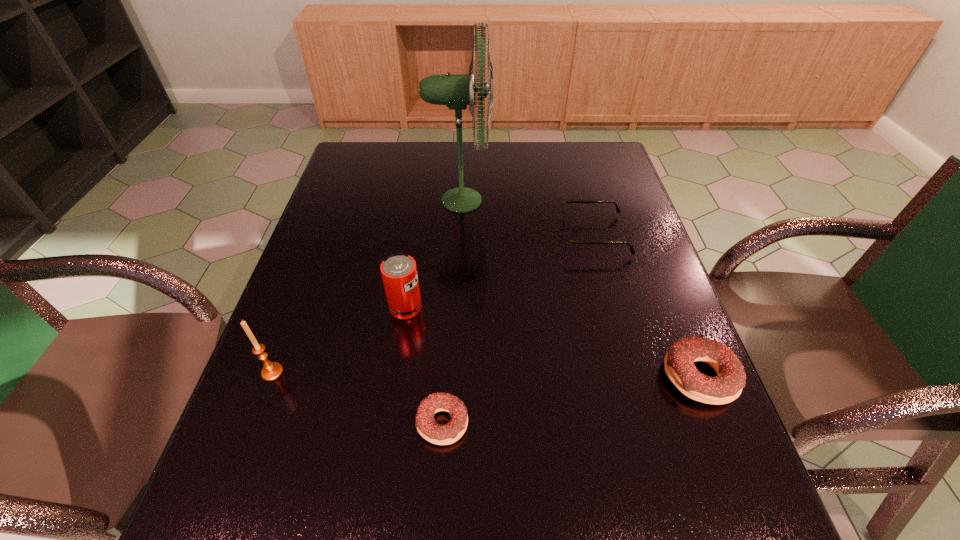
The image size is (960, 540). In order to click on vacant space located 0.230m on the front-facing side of the tallest object in this screenshot , I will do `click(567, 200)`.

Locate an element on the screen. Image resolution: width=960 pixels, height=540 pixels. vacant space positioned 0.150m at the hinge ends of the spectacles is located at coordinates (506, 235).

The width and height of the screenshot is (960, 540). I want to click on free spot located at the hinge ends of the spectacles, so click(x=535, y=235).

Where is `free space located at the hinge ends of the spectacles`? The height and width of the screenshot is (540, 960). free space located at the hinge ends of the spectacles is located at coordinates (451, 235).

At what (x,y) coordinates should I click in order to perform the action: click on free spot located 0.130m on the right of the leftmost object. Please return your answer as a coordinate pair (x, y). The width and height of the screenshot is (960, 540). Looking at the image, I should click on (346, 372).

Where is `blank space located on the front of the fourth shortest object`? This screenshot has width=960, height=540. blank space located on the front of the fourth shortest object is located at coordinates (382, 462).

Identify the location of object that is at the far edge. The image size is (960, 540). (456, 91).

Find the location of a particular element. The width and height of the screenshot is (960, 540). object at the near edge is located at coordinates (431, 431).

Identify the location of object at the left edge. The width and height of the screenshot is (960, 540). (271, 370).

Image resolution: width=960 pixels, height=540 pixels. What are the coordinates of `doughnut at the right edge` in the screenshot? It's located at (724, 388).